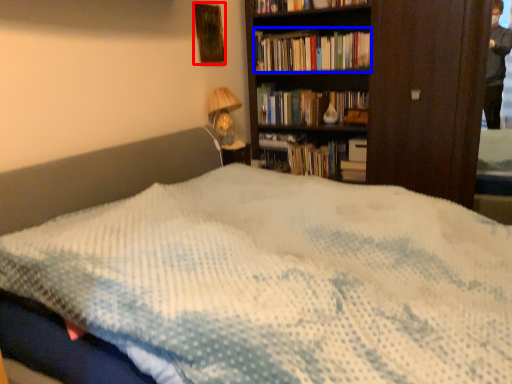
Question: Which object is closer to the camera taking this photo, picture frame (highlighted by a red box) or book (highlighted by a blue box)?

Choices:
 (A) picture frame
 (B) book

Answer: (A)